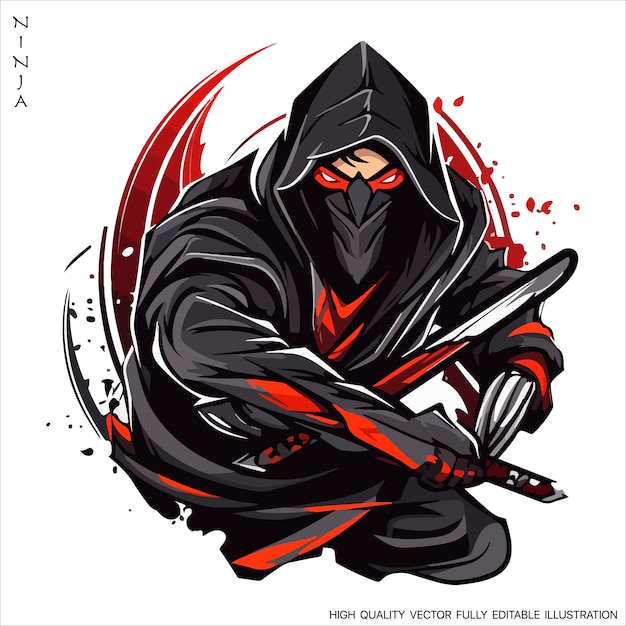
Locate an element on the screen. Image resolution: width=626 pixels, height=626 pixels. hood is located at coordinates (384, 95).